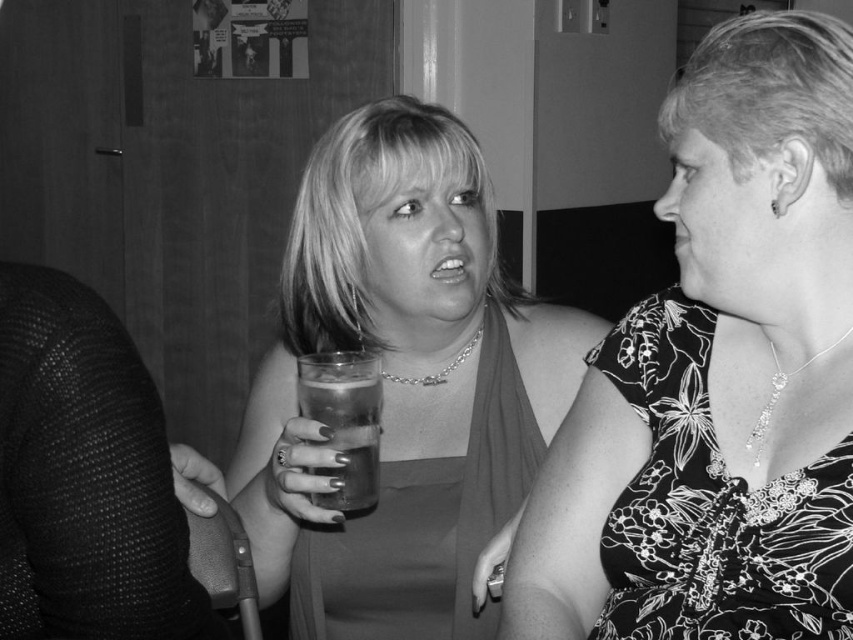
Can you confirm if floral-patterned dress at center-right is thinner than translucent glass at center?

Incorrect, floral-patterned dress at center-right's width is not less than translucent glass at center's.

Does floral-patterned dress at center-right come in front of translucent glass at center?

Yes, it is in front of translucent glass at center.

At what (x,y) coordinates should I click in order to perform the action: click on floral-patterned dress at center-right. Please return your answer as a coordinate pair (x, y). Looking at the image, I should click on (718, 376).

This screenshot has width=853, height=640. What do you see at coordinates (718, 376) in the screenshot?
I see `floral-patterned dress at center-right` at bounding box center [718, 376].

In the scene shown: Is floral-patterned dress at center-right shorter than smooth glass at center?

Yes.

Measure the distance between point [706,170] and camera.

They are 77.73 centimeters apart.

Find the location of a particular element. The image size is (853, 640). floral-patterned dress at center-right is located at coordinates click(x=718, y=376).

Between smooth glass at center and translucent glass at center, which one has more height?

Standing taller between the two is smooth glass at center.

Find the location of a particular element. The height and width of the screenshot is (640, 853). smooth glass at center is located at coordinates (403, 385).

Locate an element on the screen. This screenshot has height=640, width=853. smooth glass at center is located at coordinates (403, 385).